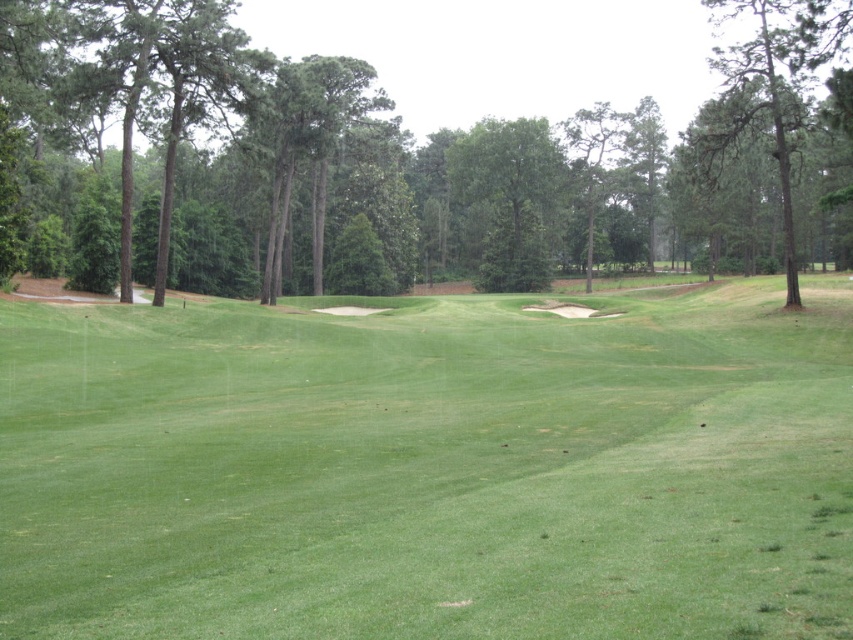
Question: Which of these objects is positioned closest to the green leafy tree at center?

Choices:
 (A) green textured pine tree at upper right
 (B) green grassy fairway at center

Answer: (A)

Question: Which point is closer to the camera?

Choices:
 (A) green leafy tree at center
 (B) green grassy fairway at center
 (C) green textured pine tree at upper right

Answer: (B)

Question: Is green grassy fairway at center positioned before green leafy tree at center?

Choices:
 (A) yes
 (B) no

Answer: (A)

Question: Does green grassy fairway at center have a smaller size compared to green leafy tree at center?

Choices:
 (A) yes
 (B) no

Answer: (A)

Question: Is green leafy tree at center smaller than green textured pine tree at upper right?

Choices:
 (A) yes
 (B) no

Answer: (B)

Question: Which is farther from the green grassy fairway at center?

Choices:
 (A) green textured pine tree at upper right
 (B) green leafy tree at center

Answer: (B)